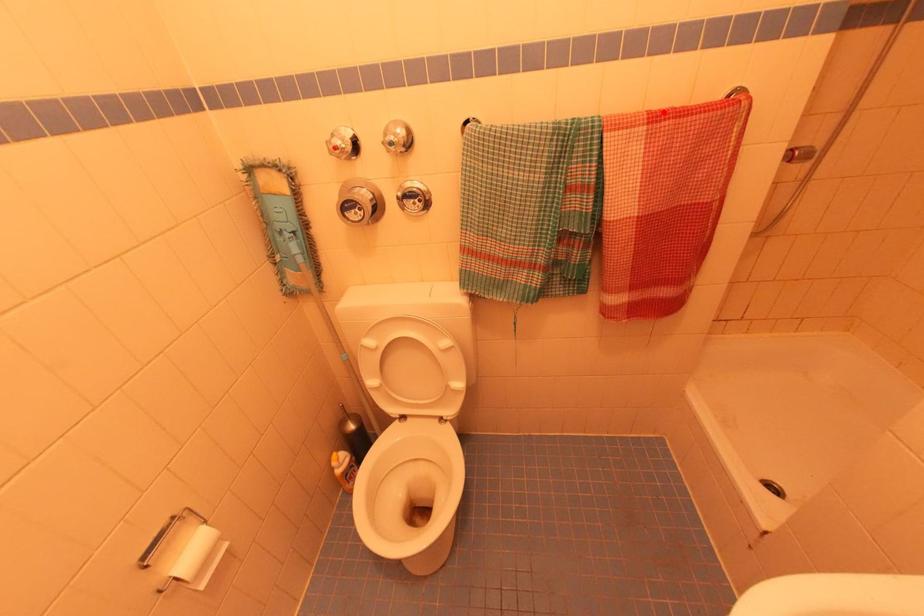
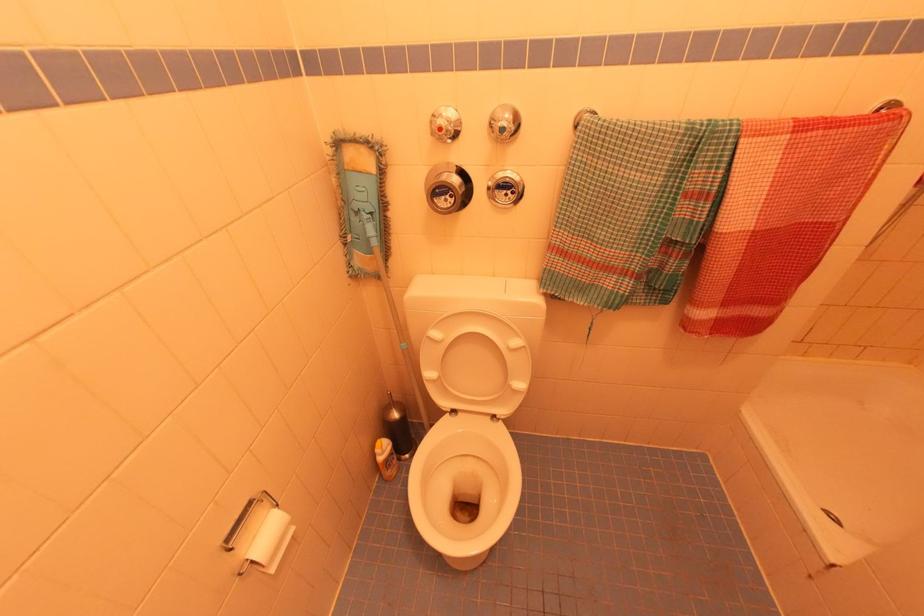
Question: I am providing you with two images of the same scene from different viewpoints. A red point is marked on the first image. Is the red point's position out of view in image 2?

Choices:
 (A) Yes
 (B) No

Answer: (B)